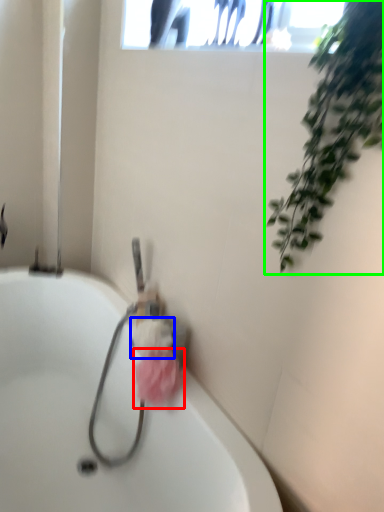
Question: Based on their relative distances, which object is farther from flower (highlighted by a red box)? Choose from flower (highlighted by a blue box) and houseplant (highlighted by a green box).

Choices:
 (A) flower
 (B) houseplant

Answer: (B)